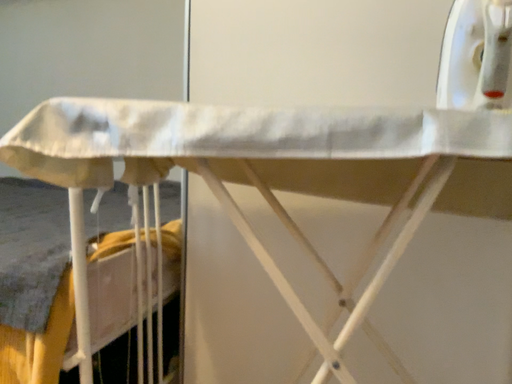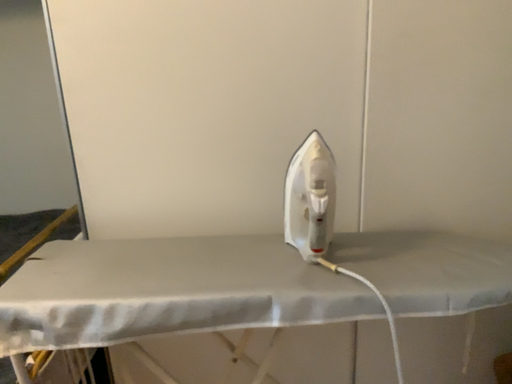
Question: How did the camera likely rotate when shooting the video?

Choices:
 (A) rotated left
 (B) rotated right

Answer: (B)